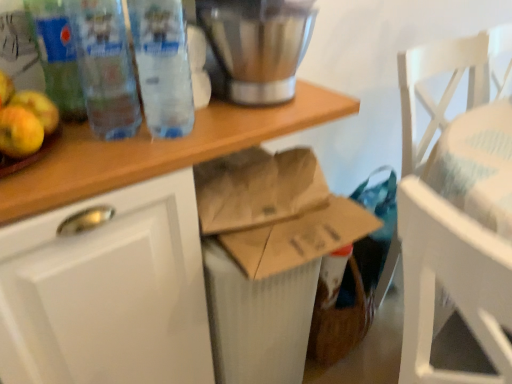
The image size is (512, 384). What are the coordinates of `vacant region in front of transparent plastic bottles at upper left, arranged as the 1th bottle when viewed from the right` in the screenshot? It's located at (136, 160).